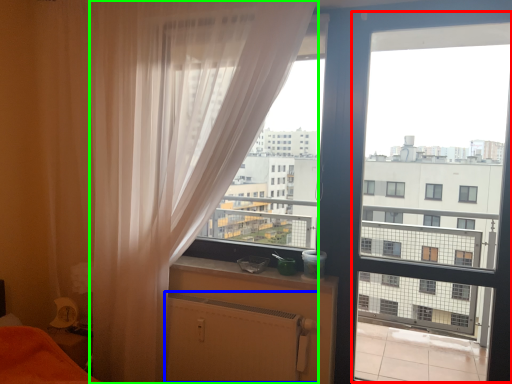
Question: Estimate the real-world distances between objects in this image. Which object is closer to screen door (highlighted by a red box), radiator (highlighted by a blue box) or curtain (highlighted by a green box)?

Choices:
 (A) radiator
 (B) curtain

Answer: (A)